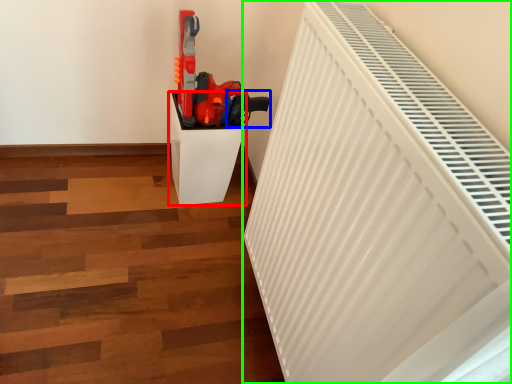
Question: Which object is positioned farthest from furniture (highlighted by a red box)? Select from weapon (highlighted by a blue box) and radiator (highlighted by a green box).

Choices:
 (A) weapon
 (B) radiator

Answer: (B)